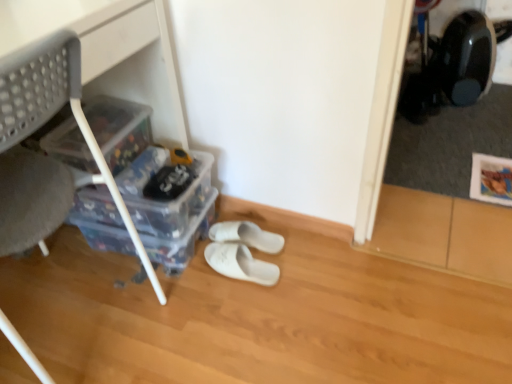
Question: Is white fabric slippers at center, which is the 1th footwear from back to front, facing away from transparent plastic storage box at lower left, positioned as the third storage box in top-to-bottom order?

Choices:
 (A) no
 (B) yes

Answer: (B)

Question: Is white fabric slippers at center, which is the 1th footwear from back to front, thinner than transparent plastic storage box at lower left, the first storage box positioned from the bottom?

Choices:
 (A) no
 (B) yes

Answer: (B)

Question: From a real-world perspective, is white fabric slippers at center, which is the 1th footwear from back to front, over transparent plastic storage box at lower left, the first storage box positioned from the bottom?

Choices:
 (A) yes
 (B) no

Answer: (B)

Question: Would you consider white fabric slippers at center, which is counted as the second footwear, starting from the front, to be distant from transparent plastic storage box at lower left, the first storage box positioned from the bottom?

Choices:
 (A) yes
 (B) no

Answer: (B)

Question: From the image's perspective, is white fabric slippers at center, which is counted as the second footwear, starting from the front, beneath transparent plastic storage box at lower left, the first storage box positioned from the bottom?

Choices:
 (A) no
 (B) yes

Answer: (B)

Question: Is white fabric slippers at center, which is the 1th footwear from back to front, located outside transparent plastic storage box at lower left, positioned as the third storage box in top-to-bottom order?

Choices:
 (A) no
 (B) yes

Answer: (B)

Question: Can you confirm if clear plastic storage box at left, which ranks as the 3th storage box in bottom-to-top order, is thinner than white fabric slippers at center, which is counted as the second footwear, starting from the front?

Choices:
 (A) yes
 (B) no

Answer: (A)

Question: Does clear plastic storage box at left, arranged as the first storage box when viewed from the top, have a greater height compared to white fabric slippers at center, which is counted as the second footwear, starting from the front?

Choices:
 (A) no
 (B) yes

Answer: (B)

Question: Is clear plastic storage box at left, arranged as the first storage box when viewed from the top, far away from white fabric slippers at center, which is the 1th footwear from back to front?

Choices:
 (A) no
 (B) yes

Answer: (A)

Question: Is clear plastic storage box at left, arranged as the first storage box when viewed from the top, behind white fabric slippers at center, which is counted as the second footwear, starting from the front?

Choices:
 (A) no
 (B) yes

Answer: (A)

Question: Considering the relative positions of clear plastic storage box at left, arranged as the first storage box when viewed from the top, and white fabric slippers at center, which is the 1th footwear from back to front, in the image provided, is clear plastic storage box at left, arranged as the first storage box when viewed from the top, to the right of white fabric slippers at center, which is the 1th footwear from back to front, from the viewer's perspective?

Choices:
 (A) no
 (B) yes

Answer: (A)

Question: Is white fabric slippers at center, which is counted as the second footwear, starting from the front, surrounded by clear plastic storage box at left, which ranks as the 3th storage box in bottom-to-top order?

Choices:
 (A) yes
 (B) no

Answer: (B)

Question: Is white fabric slippers at center, which is counted as the second footwear, starting from the front, positioned in front of clear plastic storage box at left, arranged as the first storage box when viewed from the top?

Choices:
 (A) no
 (B) yes

Answer: (A)